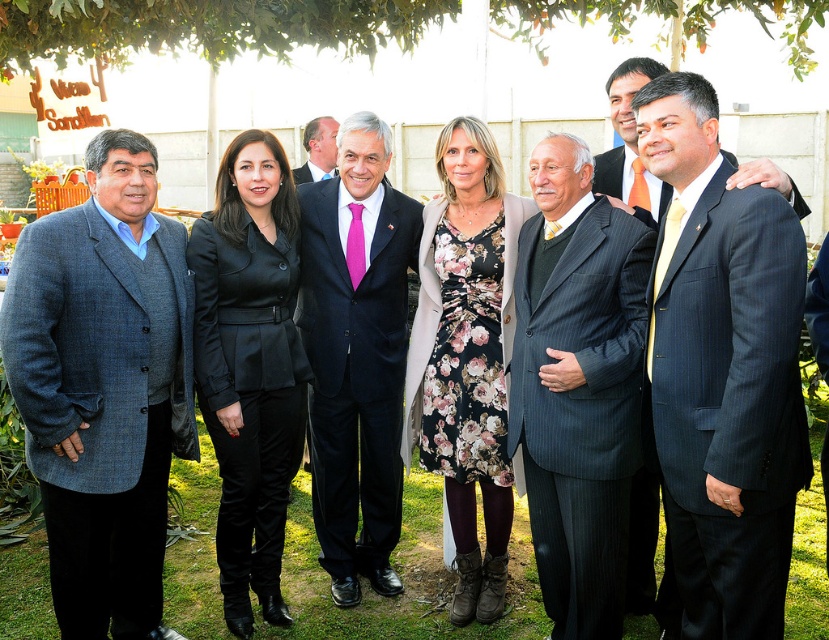
You are standing at point (x=260, y=152) and want to walk to point (x=571, y=588). Which direction should you move?

You should move forward because point (x=571, y=588) is in front of point (x=260, y=152).

You are standing at the center of the garden and want to find the black satin suit at center. According to the coordinates provided, in which direction should you move to locate it?

The black satin suit at center is located at coordinates point (250, 365). Since you are at the center of the garden, you should move to the right and slightly downward to reach the coordinates point (250, 365) where the black satin suit at center is positioned.